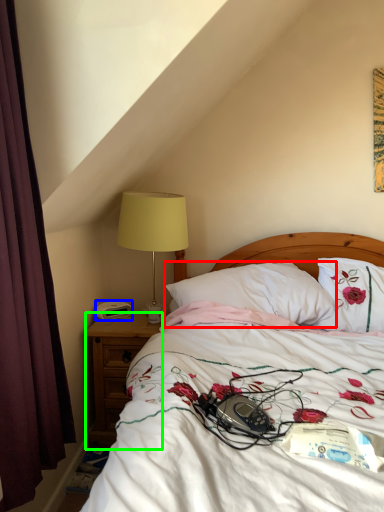
Question: Which object is the closest to the pillow (highlighted by a red box)? Choose among these: alarm clock (highlighted by a blue box) or nightstand (highlighted by a green box).

Choices:
 (A) alarm clock
 (B) nightstand

Answer: (B)